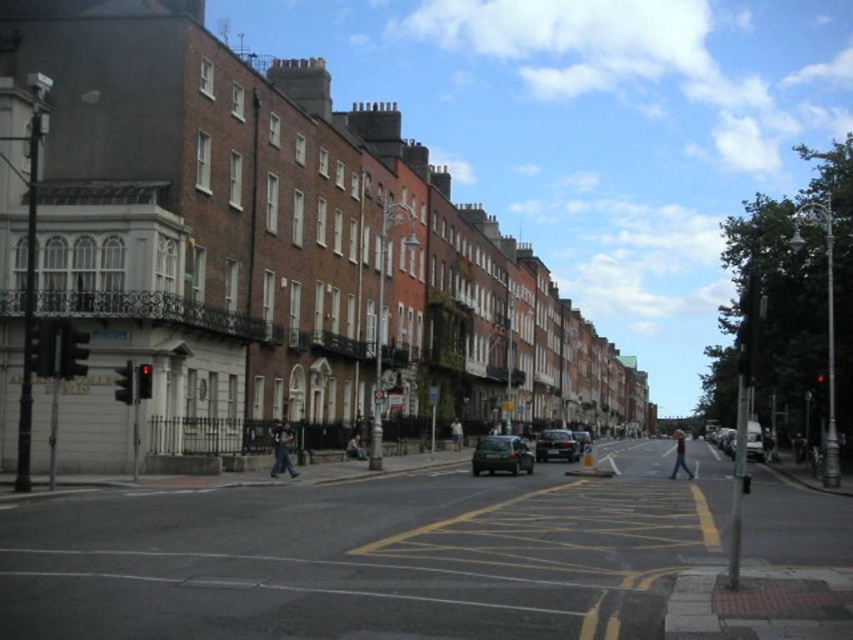
Question: Which object is farther from the camera taking this photo?

Choices:
 (A) shiny black sedan at center
 (B) metallic silver car at center
 (C) light brown leather jacket at center
 (D) shiny black car at center

Answer: (A)

Question: Does shiny black car at center lie behind light brown leather jacket at center?

Choices:
 (A) yes
 (B) no

Answer: (A)

Question: Is shiny black car at center to the left of dark gray fabric jacket at center from the viewer's perspective?

Choices:
 (A) yes
 (B) no

Answer: (B)

Question: Among these points, which one is farthest from the camera?

Choices:
 (A) click(x=561, y=442)
 (B) click(x=460, y=442)
 (C) click(x=675, y=451)

Answer: (C)

Question: Which point is farther to the camera?

Choices:
 (A) light blue jeans at center
 (B) light brown leather jacket at center

Answer: (B)

Question: Is metallic silver car at center thinner than dark gray fabric jacket at center?

Choices:
 (A) yes
 (B) no

Answer: (B)